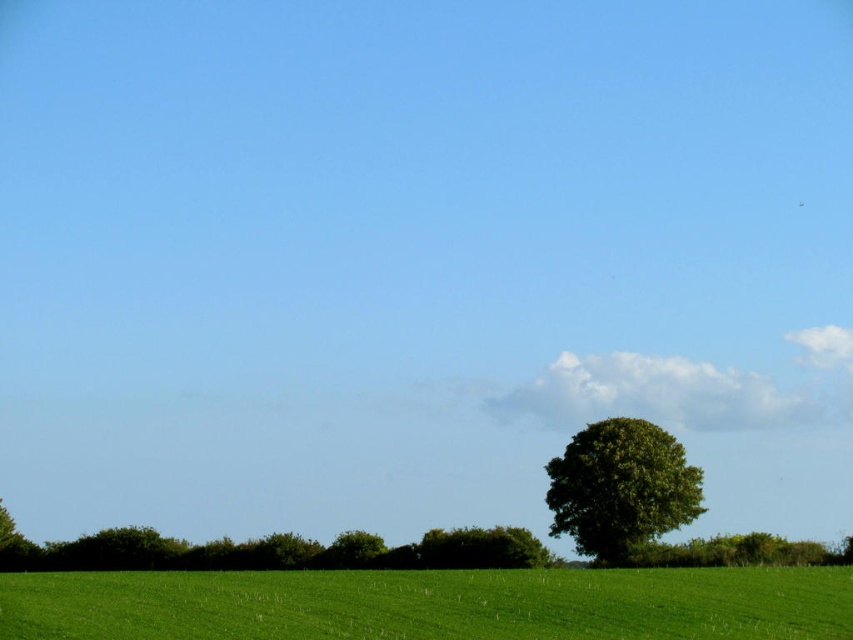
How far apart are green grassy field at lower center and green leafy tree at center?

green grassy field at lower center is 18.69 meters away from green leafy tree at center.

From the picture: Is green grassy field at lower center to the right of green leafy tree at center from the viewer's perspective?

In fact, green grassy field at lower center is to the left of green leafy tree at center.

You are a GUI agent. You are given a task and a screenshot of the screen. Output one action in this format:
    pyautogui.click(x=<x>, y=<y>)
    Task: Click on the green grassy field at lower center
    
    Given the screenshot: What is the action you would take?
    pyautogui.click(x=431, y=604)